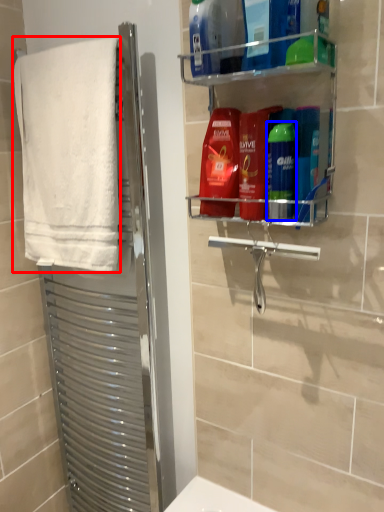
Question: Among these objects, which one is farthest to the camera, towel (highlighted by a red box) or toiletry (highlighted by a blue box)?

Choices:
 (A) towel
 (B) toiletry

Answer: (A)